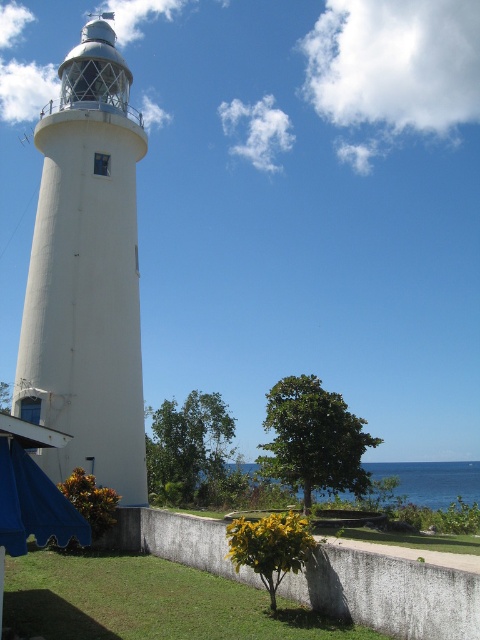
Question: Which point is closer to the camera?

Choices:
 (A) blue water at lower center
 (B) white matte/lightweight tower at center

Answer: (B)

Question: Among these points, which one is nearest to the camera?

Choices:
 (A) (83, 164)
 (B) (477, 483)

Answer: (A)

Question: From the image, what is the correct spatial relationship of white matte/lightweight tower at center in relation to blue water at lower center?

Choices:
 (A) below
 (B) above

Answer: (B)

Question: Among these objects, which one is farthest from the camera?

Choices:
 (A) white matte/lightweight tower at center
 (B) blue water at lower center

Answer: (B)

Question: Is white matte/lightweight tower at center closer to camera compared to blue water at lower center?

Choices:
 (A) no
 (B) yes

Answer: (B)

Question: Is white matte/lightweight tower at center to the right of blue water at lower center from the viewer's perspective?

Choices:
 (A) yes
 (B) no

Answer: (B)